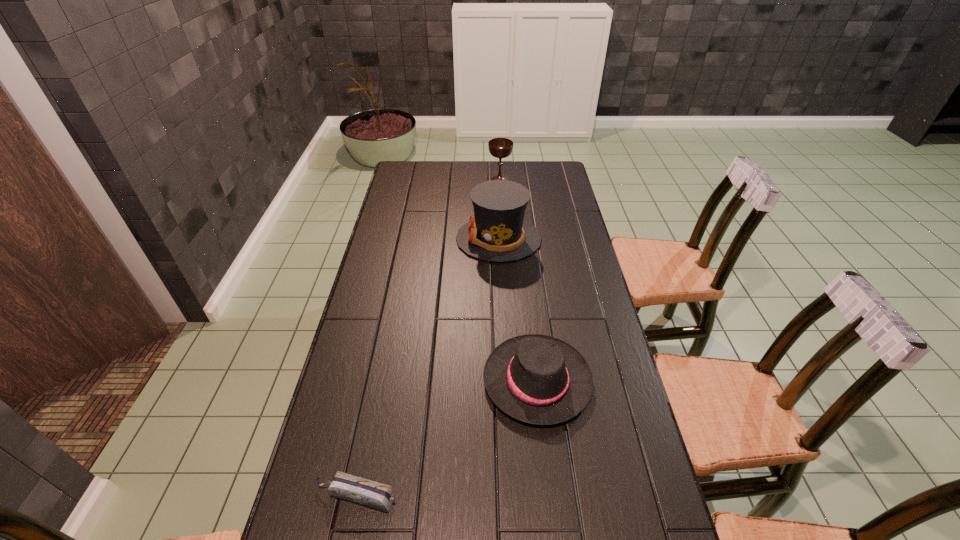
Locate an element on the screen. vacant space located on the front of the farthest object is located at coordinates (503, 239).

Find the location of a particular element. Image resolution: width=960 pixels, height=540 pixels. vacant point located 0.360m on the back of the third farthest object is located at coordinates (523, 261).

Find the location of a particular element. The height and width of the screenshot is (540, 960). vacant space located 0.370m on the back of the nearest object is located at coordinates (385, 350).

At what (x,y) coordinates should I click in order to perform the action: click on object present at the far edge. Please return your answer as a coordinate pair (x, y). The image size is (960, 540). Looking at the image, I should click on (500, 148).

Locate an element on the screen. This screenshot has height=540, width=960. object that is positioned at the left edge is located at coordinates (376, 495).

Find the location of a particular element. The width and height of the screenshot is (960, 540). blank space at the far edge of the desktop is located at coordinates (461, 165).

At what (x,y) coordinates should I click in order to perform the action: click on vacant space at the left edge of the desktop. Please return your answer as a coordinate pair (x, y). This screenshot has width=960, height=540. Looking at the image, I should click on (368, 328).

In the image, there is a desktop. Identify the location of vacant space at the right edge. (542, 196).

Find the location of a particular element. This screenshot has width=960, height=540. free region at the far left corner of the desktop is located at coordinates (399, 162).

This screenshot has height=540, width=960. Identify the location of vacant space at the far right corner of the desktop. (564, 180).